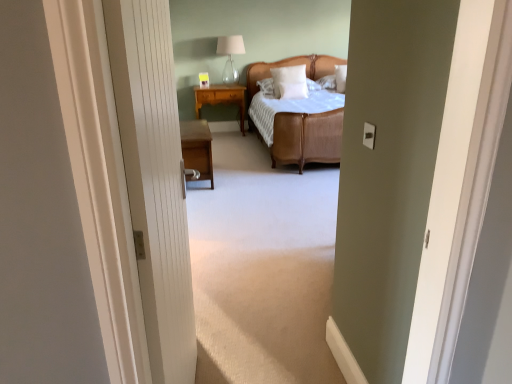
The image size is (512, 384). What do you see at coordinates (230, 55) in the screenshot? I see `matte glass table lamp at upper center` at bounding box center [230, 55].

Find the location of a particular element. This screenshot has height=384, width=512. matte glass table lamp at upper center is located at coordinates (230, 55).

Find the location of a particular element. The image size is (512, 384). white soft pillow at center, which is counted as the second pillow, starting from the bottom is located at coordinates (290, 82).

This screenshot has height=384, width=512. What are the coordinates of `white textured door at center` in the screenshot? It's located at (154, 180).

Measure the distance between light brown wood nightstand at center, the first nightstand when ordered from back to front, and camera.

light brown wood nightstand at center, the first nightstand when ordered from back to front, is 5.70 meters from camera.

The height and width of the screenshot is (384, 512). Find the location of `matte glass table lamp at upper center`. matte glass table lamp at upper center is located at coordinates (230, 55).

From a real-world perspective, which is physically below, light brown wood nightstand at center, the 1th nightstand when ordered from top to bottom, or woven rattan bed at center?

light brown wood nightstand at center, the 1th nightstand when ordered from top to bottom, from a real-world perspective.

Is light brown wood nightstand at center, the first nightstand when ordered from back to front, taller or shorter than woven rattan bed at center?

Clearly, light brown wood nightstand at center, the first nightstand when ordered from back to front, is shorter compared to woven rattan bed at center.

In terms of size, does light brown wood nightstand at center, which is counted as the second nightstand, starting from the bottom, appear bigger or smaller than woven rattan bed at center?

Clearly, light brown wood nightstand at center, which is counted as the second nightstand, starting from the bottom, is smaller in size than woven rattan bed at center.

Which is more to the left, light brown wood nightstand at center, which is counted as the second nightstand, starting from the bottom, or woven rattan bed at center?

light brown wood nightstand at center, which is counted as the second nightstand, starting from the bottom, is more to the left.

Between white textured door at center and light brown wood nightstand at center, the 1th nightstand when ordered from top to bottom, which one has larger size?

With larger size is white textured door at center.

Identify the location of door above the light brown wood nightstand at center, the 1th nightstand when ordered from top to bottom (from a real-world perspective). (154, 180).

From their relative heights in the image, would you say white textured door at center is taller or shorter than light brown wood nightstand at center, the first nightstand when ordered from back to front?

In the image, white textured door at center appears to be taller than light brown wood nightstand at center, the first nightstand when ordered from back to front.

Which object is closer to the camera taking this photo, white textured door at center or light brown wood nightstand at center, positioned as the second nightstand in front-to-back order?

white textured door at center is in front.

Can you confirm if white soft pillow at center, the 2th pillow from the top, is smaller than white textured door at center?

Indeed, white soft pillow at center, the 2th pillow from the top, has a smaller size compared to white textured door at center.

Is white soft pillow at center, the first pillow ordered from the bottom, wider or thinner than white textured door at center?

white soft pillow at center, the first pillow ordered from the bottom, is wider than white textured door at center.

Is white soft pillow at center, the 2th pillow from the top, closer to camera compared to white textured door at center?

No, white soft pillow at center, the 2th pillow from the top, is further to the viewer.

From a real-world perspective, is white soft pillow at center, the first pillow ordered from the bottom, positioned above or below white textured door at center?

white soft pillow at center, the first pillow ordered from the bottom, is situated lower than white textured door at center in the real world.

In the image, is white textured door at center positioned in front of or behind white soft pillow at center, placed as the first pillow when sorted from top to bottom?

Clearly, white textured door at center is in front of white soft pillow at center, placed as the first pillow when sorted from top to bottom.

Can you see white textured door at center touching white soft pillow at center, placed as the first pillow when sorted from top to bottom?

No.

In the scene shown: Would you say white textured door at center is outside white soft pillow at center, placed as the first pillow when sorted from top to bottom?

That's correct, white textured door at center is outside of white soft pillow at center, placed as the first pillow when sorted from top to bottom.

Considering the sizes of white textured door at center and white soft pillow at center, which is counted as the second pillow, starting from the bottom, in the image, is white textured door at center taller or shorter than white soft pillow at center, which is counted as the second pillow, starting from the bottom,?

Considering their sizes, white textured door at center has more height than white soft pillow at center, which is counted as the second pillow, starting from the bottom.

The image size is (512, 384). In order to click on table lamp on the right of wooden nightstand at left, which appears as the second nightstand when viewed from the back in this screenshot , I will do `click(230, 55)`.

Could you measure the distance between matte glass table lamp at upper center and wooden nightstand at left, which is counted as the first nightstand, starting from the bottom?

matte glass table lamp at upper center and wooden nightstand at left, which is counted as the first nightstand, starting from the bottom, are 7.30 feet apart from each other.

Is matte glass table lamp at upper center aimed at wooden nightstand at left, marked as the first nightstand in a front-to-back arrangement?

No, matte glass table lamp at upper center does not turn towards wooden nightstand at left, marked as the first nightstand in a front-to-back arrangement.

From a real-world perspective, between matte glass table lamp at upper center and wooden nightstand at left, which appears as the second nightstand when viewed from the back, who is vertically higher?

matte glass table lamp at upper center.

Could you tell me if woven rattan bed at center is facing light brown wood nightstand at center, positioned as the second nightstand in front-to-back order?

No, woven rattan bed at center does not turn towards light brown wood nightstand at center, positioned as the second nightstand in front-to-back order.

Is woven rattan bed at center to the left or to the right of light brown wood nightstand at center, positioned as the second nightstand in front-to-back order, in the image?

Clearly, woven rattan bed at center is on the right of light brown wood nightstand at center, positioned as the second nightstand in front-to-back order, in the image.

Is woven rattan bed at center directly adjacent to light brown wood nightstand at center, the 1th nightstand when ordered from top to bottom?

woven rattan bed at center and light brown wood nightstand at center, the 1th nightstand when ordered from top to bottom, are not in contact.

I want to click on bed above the light brown wood nightstand at center, positioned as the second nightstand in front-to-back order (from a real-world perspective), so point(307,138).

Considering the sizes of matte glass table lamp at upper center and white soft pillow at center, the 2th pillow from the top, in the image, is matte glass table lamp at upper center bigger or smaller than white soft pillow at center, the 2th pillow from the top,?

Considering their sizes, matte glass table lamp at upper center takes up more space than white soft pillow at center, the 2th pillow from the top.

Is point (243, 51) farther from viewer compared to point (284, 94)?

Yes, point (243, 51) is behind point (284, 94).

From the image's perspective, is matte glass table lamp at upper center above or below white soft pillow at center, the 2th pillow from the top?

From the image's perspective, matte glass table lamp at upper center appears above white soft pillow at center, the 2th pillow from the top.

I want to click on nightstand that is above the woven rattan bed at center (from the image's perspective), so click(x=221, y=98).

From a real-world perspective, starting from the white textured door at center, which nightstand is the 1st one below it? Please provide its 2D coordinates.

[(221, 98)]

Based on their spatial positions, is white soft pillow at center, the 2th pillow from the top, or light brown wood nightstand at center, which is counted as the second nightstand, starting from the bottom, closer to white soft pillow at center, placed as the first pillow when sorted from top to bottom?

Based on the image, white soft pillow at center, the 2th pillow from the top, appears to be nearer to white soft pillow at center, placed as the first pillow when sorted from top to bottom.

In the scene shown: Looking at the image, which one is located further to woven rattan bed at center, matte glass table lamp at upper center or white soft pillow at center, the first pillow ordered from the bottom?

Based on the image, matte glass table lamp at upper center appears to be further to woven rattan bed at center.

Which object lies nearer to the anchor point white textured door at center, white soft pillow at center, the first pillow ordered from the bottom, or wooden nightstand at left, which is counted as the second nightstand, starting from the top?

The object closer to white textured door at center is wooden nightstand at left, which is counted as the second nightstand, starting from the top.

Considering their positions, is light brown wood nightstand at center, the first nightstand when ordered from back to front, positioned closer to white soft pillow at center, the first pillow ordered from the bottom, than wooden nightstand at left, marked as the first nightstand in a front-to-back arrangement?

light brown wood nightstand at center, the first nightstand when ordered from back to front, is positioned closer to the anchor white soft pillow at center, the first pillow ordered from the bottom.

Looking at the image, which one is located closer to white textured door at center, matte glass table lamp at upper center or light brown wood nightstand at center, the 1th nightstand when ordered from top to bottom?

light brown wood nightstand at center, the 1th nightstand when ordered from top to bottom.

From the picture: Looking at the image, which one is located closer to white textured door at center, white soft pillow at center, which is counted as the second pillow, starting from the bottom, or woven rattan bed at center?

woven rattan bed at center lies closer to white textured door at center than the other object.

Based on their spatial positions, is matte glass table lamp at upper center or wooden nightstand at left, marked as the first nightstand in a front-to-back arrangement, further from white soft pillow at center, the 2th pillow from the top?

wooden nightstand at left, marked as the first nightstand in a front-to-back arrangement, is positioned further to the anchor white soft pillow at center, the 2th pillow from the top.

Based on their spatial positions, is light brown wood nightstand at center, positioned as the second nightstand in front-to-back order, or white textured door at center further from wooden nightstand at left, which is counted as the first nightstand, starting from the bottom?

white textured door at center lies further to wooden nightstand at left, which is counted as the first nightstand, starting from the bottom, than the other object.

At what (x,y) coordinates should I click in order to perform the action: click on bed between wooden nightstand at left, which appears as the second nightstand when viewed from the back, and matte glass table lamp at upper center, along the z-axis. Please return your answer as a coordinate pair (x, y). This screenshot has height=384, width=512. Looking at the image, I should click on (307, 138).

At what (x,y) coordinates should I click in order to perform the action: click on bed located between white textured door at center and matte glass table lamp at upper center in the depth direction. Please return your answer as a coordinate pair (x, y). The width and height of the screenshot is (512, 384). Looking at the image, I should click on (307, 138).

Find the location of `nightstand between white textured door at center and matte glass table lamp at upper center from front to back`. nightstand between white textured door at center and matte glass table lamp at upper center from front to back is located at coordinates (197, 148).

I want to click on table lamp between wooden nightstand at left, which is counted as the second nightstand, starting from the top, and white soft pillow at center, which is counted as the second pillow, starting from the bottom, in the front-back direction, so click(230, 55).